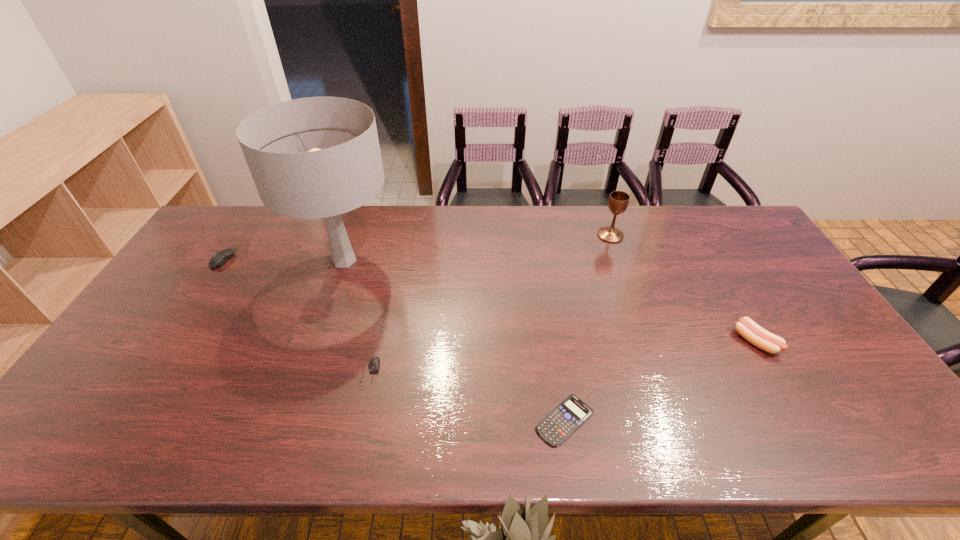
You are a GUI agent. You are given a task and a screenshot of the screen. Output one action in this format:
    pyautogui.click(x=<x>, y=<y>)
    Task: Click on the vacant point that satisfies the following two spatial constraints: 1. on the front-facing side of the tallest object; 2. on the left side of the calculator
    
    Given the screenshot: What is the action you would take?
    pyautogui.click(x=290, y=420)